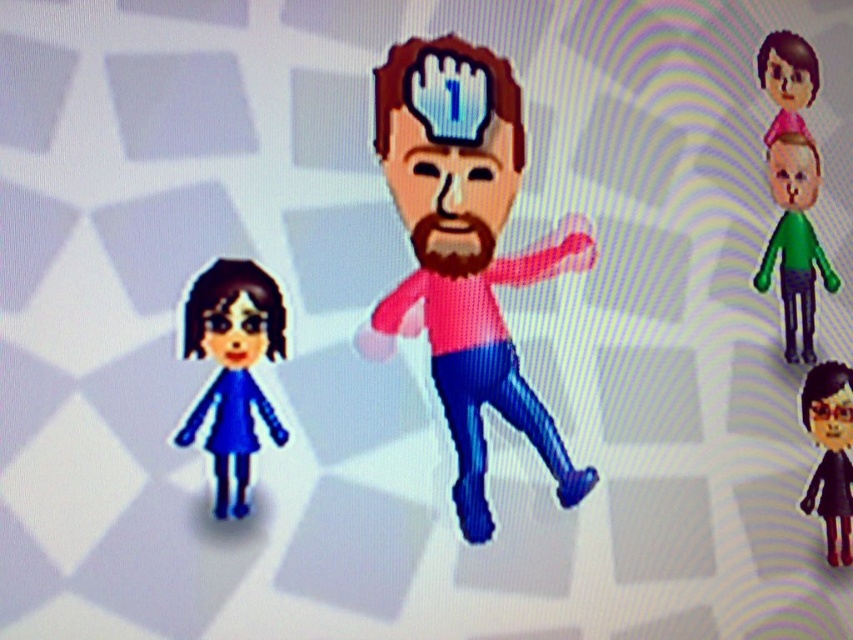
Looking at this image, you are navigating a digital environment and need to move from point A to point B. The points are labeled as point (813, 269) and point (824, 364). Which point is closer to your current position if you are standing behind the character with the blue number 1 on his forehead?

Point (813, 269) is behind point (824, 364), so if you are standing behind the character with the blue number 1 on his forehead, point (813, 269) would be closer to your current position.

You are a character in this virtual space and want to move from point A to point B. Point A is at coordinate point (373, 337) and point B is at coordinate point (822, 460). Which point is closer to your current position if you are standing at the center of the image?

Point A at coordinate point (373, 337) is closer to the center of the image than point B at coordinate point (822, 460) because it is closer to the camera, which is aligned with the center position.

You are a character in the game and need to pick up both the pink matte toy at center and the black matte doll at lower right. Which object should you pick up first if you want to carry the larger one first?

You should pick up the pink matte toy at center first because it is larger than the black matte doll at lower right.